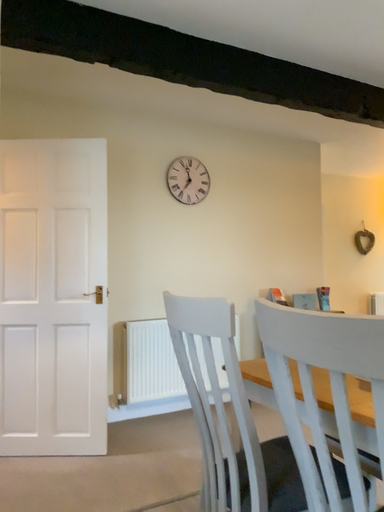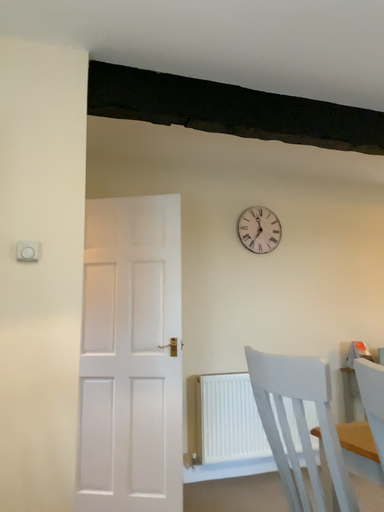
Question: Which way did the camera rotate in the video?

Choices:
 (A) rotated right
 (B) rotated left

Answer: (B)